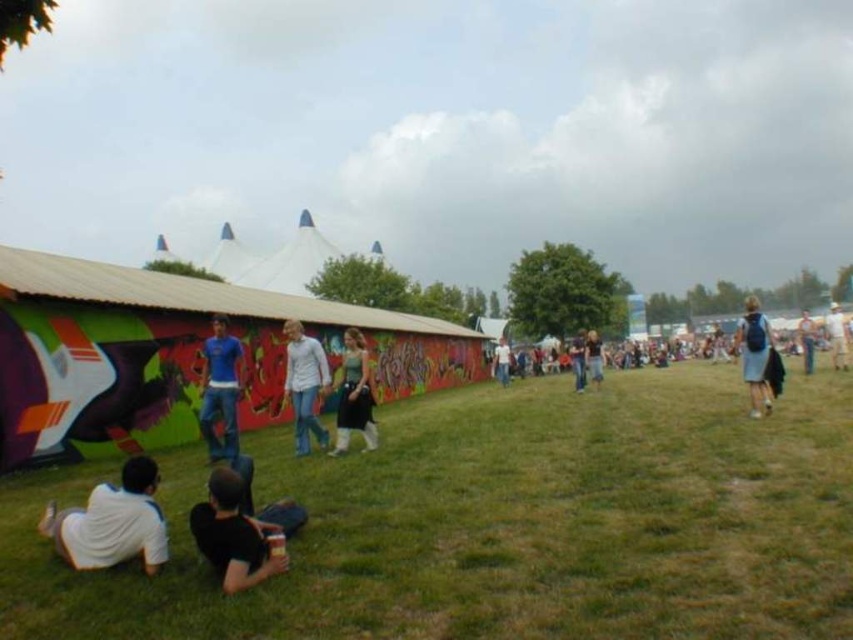
Question: Which is farther from the blue backpack at right?

Choices:
 (A) blue backpack at center-right
 (B) black matte shirt at lower center

Answer: (A)

Question: Does blue backpack at right appear on the right side of blue backpack at center-right?

Choices:
 (A) yes
 (B) no

Answer: (B)

Question: Which point appears closest to the camera in this image?

Choices:
 (A) (363, 429)
 (B) (508, 352)

Answer: (A)

Question: Which point is closer to the camera taking this photo?

Choices:
 (A) (763, 356)
 (B) (137, 467)

Answer: (B)

Question: Is green grassy field at lower center above light blue denim jeans at center?

Choices:
 (A) yes
 (B) no

Answer: (B)

Question: Can you confirm if matte blue jeans at center is smaller than green fabric dress at center?

Choices:
 (A) no
 (B) yes

Answer: (A)